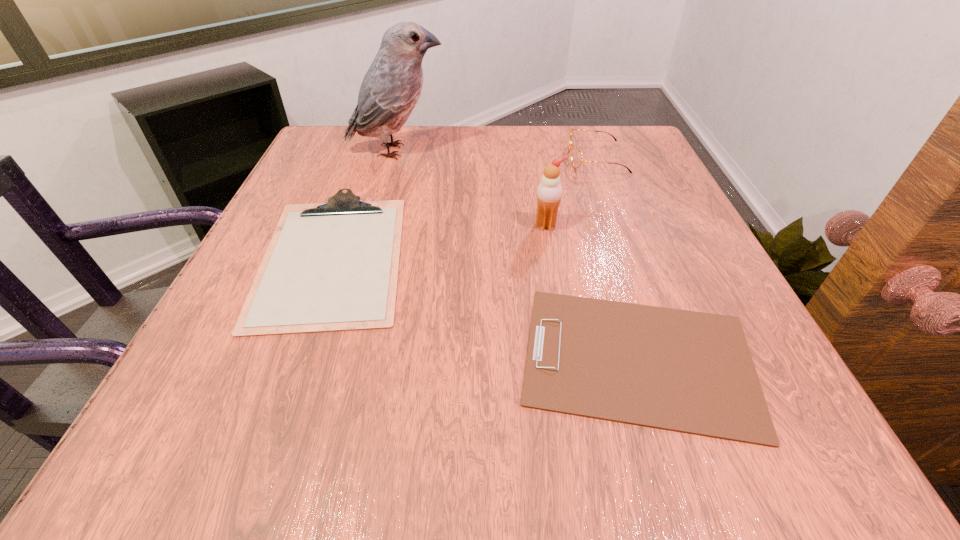
The height and width of the screenshot is (540, 960). In order to click on vacant position located 0.090m on the front-facing side of the spectacles in this screenshot , I will do `click(531, 158)`.

The width and height of the screenshot is (960, 540). I want to click on free space located on the front-facing side of the spectacles, so click(471, 158).

In order to click on vacant space located on the back of the second shortest object in this screenshot , I will do `click(373, 143)`.

I want to click on free spot located 0.140m on the left of the shorter clipboard, so click(x=420, y=359).

Locate an element on the screen. parrot at the far edge is located at coordinates (391, 87).

Identify the location of spectacles at the far edge. (576, 156).

Locate an element on the screen. The image size is (960, 540). object located at the near edge is located at coordinates (692, 372).

At what (x,y) coordinates should I click in order to perform the action: click on parrot that is at the left edge. Please return your answer as a coordinate pair (x, y). Image resolution: width=960 pixels, height=540 pixels. Looking at the image, I should click on (391, 87).

At what (x,y) coordinates should I click in order to perform the action: click on clipboard that is at the left edge. Please return your answer as a coordinate pair (x, y). Image resolution: width=960 pixels, height=540 pixels. Looking at the image, I should click on (329, 267).

Where is `spectacles that is at the right edge`? spectacles that is at the right edge is located at coordinates (576, 156).